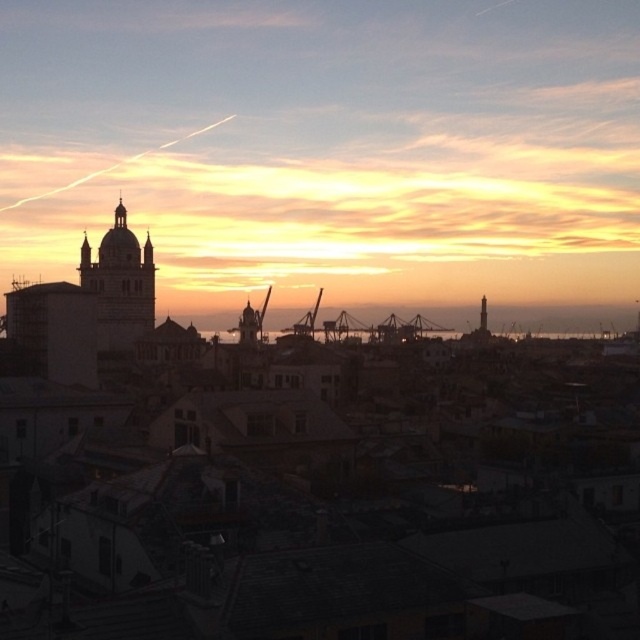
Question: Is metallic gray crane at center closer to the viewer compared to metallic industrial crane at center?

Choices:
 (A) no
 (B) yes

Answer: (A)

Question: Where is metallic gray crane at center located in relation to metallic industrial crane at center in the image?

Choices:
 (A) left
 (B) right

Answer: (A)

Question: Which point appears closest to the camera in this image?

Choices:
 (A) (305, 316)
 (B) (237, 321)

Answer: (A)

Question: Which point is closer to the camera taking this photo?

Choices:
 (A) (307, 324)
 (B) (234, 328)

Answer: (A)

Question: Does metallic gray crane at center have a greater width compared to metallic industrial crane at center?

Choices:
 (A) yes
 (B) no

Answer: (A)